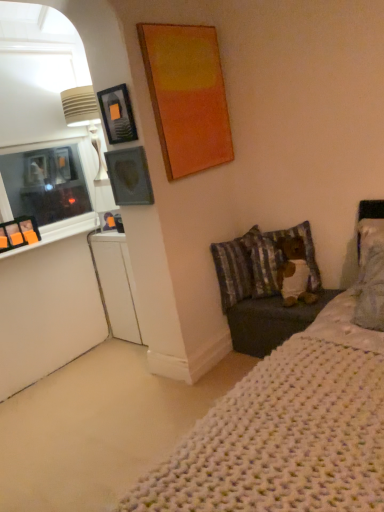
Question: Visually, is matte black picture frame at upper left, the second picture frame positioned from the bottom, positioned to the left or to the right of fluffy fabric pillow at center-right, which is the 1th pillow from right to left?

Choices:
 (A) left
 (B) right

Answer: (A)

Question: Is point (102, 117) closer or farther from the camera than point (273, 242)?

Choices:
 (A) farther
 (B) closer

Answer: (B)

Question: Which object is the farthest from the white knitted blanket at lower right?

Choices:
 (A) striped fabric pillow at lower right, marked as the first pillow in a left-to-right arrangement
 (B) matte gray picture frame at upper left, the 1th picture frame positioned from the bottom
 (C) white glossy dresser at lower left
 (D) matte black picture frame at upper left, positioned as the first picture frame in top-to-bottom order
 (E) fluffy fabric pillow at center-right, which is the 2th pillow in left-to-right order

Answer: (C)

Question: Which object is positioned closest to the fluffy fabric pillow at center-right, which is the 1th pillow from right to left?

Choices:
 (A) matte black picture frame at upper left, positioned as the first picture frame in top-to-bottom order
 (B) striped fabric pillow at lower right, marked as the first pillow in a left-to-right arrangement
 (C) white glossy dresser at lower left
 (D) matte gray picture frame at upper left, acting as the second picture frame starting from the top
 (E) white knitted blanket at lower right

Answer: (B)